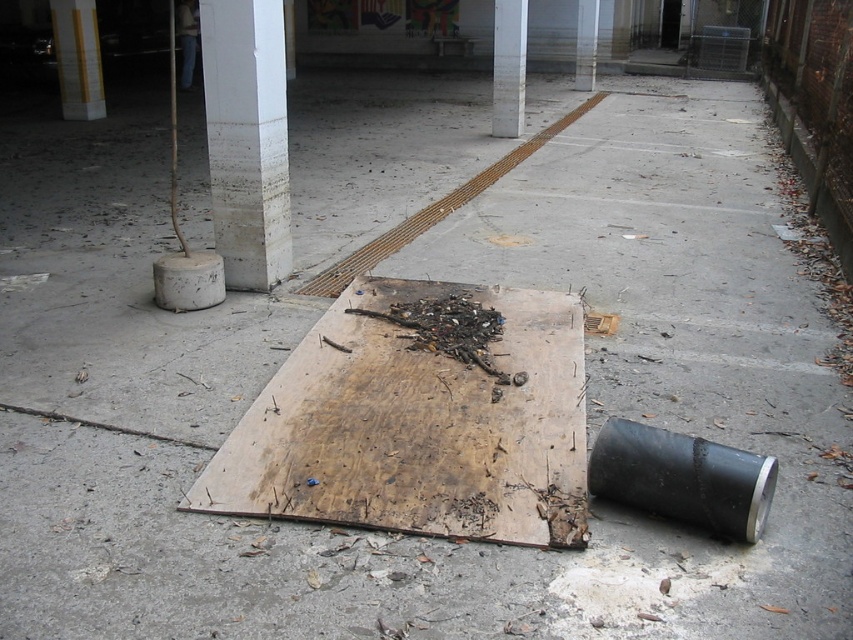
Question: Among these points, which one is nearest to the camera?

Choices:
 (A) (444, 307)
 (B) (300, 448)
 (C) (497, 90)

Answer: (B)

Question: Which object appears closest to the camera in this image?

Choices:
 (A) worn wood board at center
 (B) white smooth pillar at upper center

Answer: (A)

Question: Can you confirm if white marble pillar at upper center is thinner than white glossy pillar at center?

Choices:
 (A) no
 (B) yes

Answer: (A)

Question: Does worn wood board at center appear under white smooth pillar at upper center?

Choices:
 (A) yes
 (B) no

Answer: (A)

Question: Is worn wood board at center closer to camera compared to white smooth pillar at upper center?

Choices:
 (A) yes
 (B) no

Answer: (A)

Question: Among these points, which one is farthest from the camera?

Choices:
 (A) (512, 24)
 (B) (577, 58)
 (C) (459, 500)

Answer: (B)